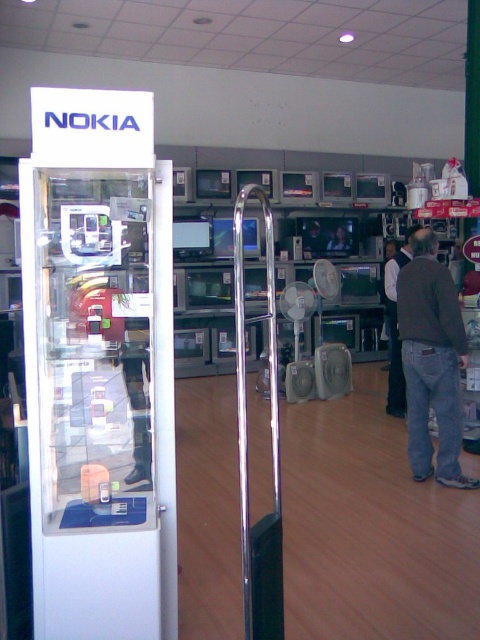
Between brown denim jacket at lower right and smooth plastic tv at center, which one is positioned lower?

brown denim jacket at lower right is lower down.

Looking at this image, which is more to the left, brown denim jacket at lower right or smooth plastic tv at center?

smooth plastic tv at center is more to the left.

Who is more forward, (x=407, y=308) or (x=344, y=228)?

Point (x=407, y=308) is more forward.

Locate an element on the screen. This screenshot has width=480, height=640. brown denim jacket at lower right is located at coordinates (432, 362).